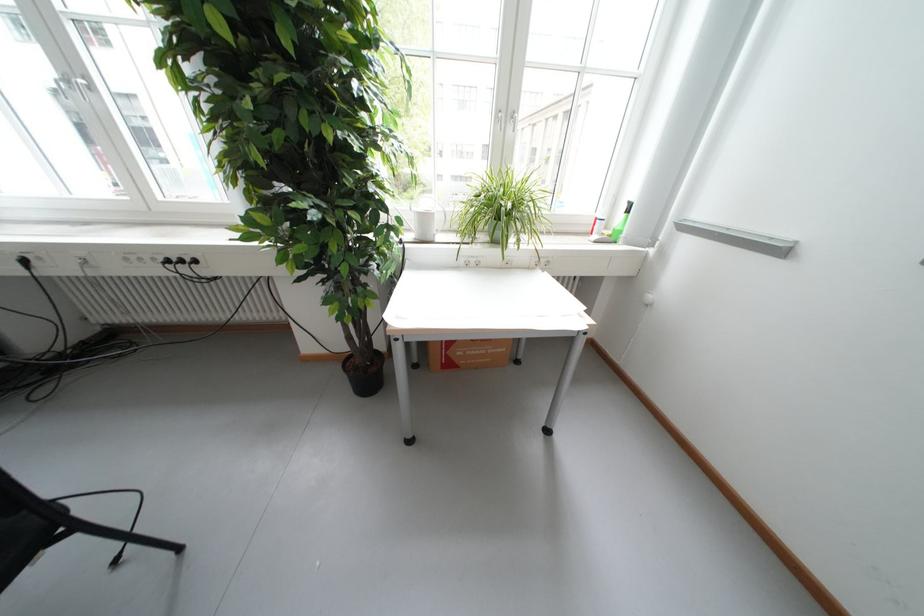
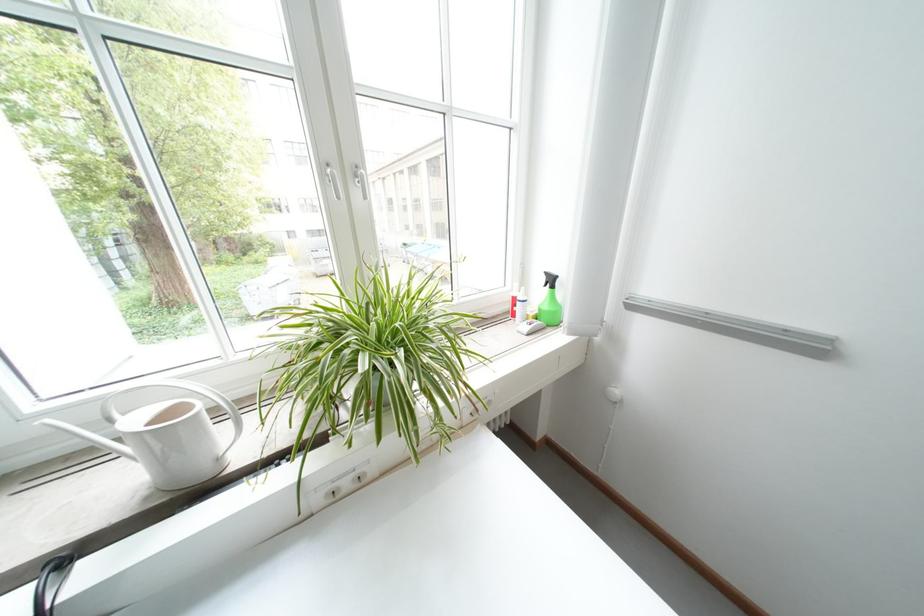
In the second image, find the point that corresponds to point (638, 204) in the first image.

(555, 275)